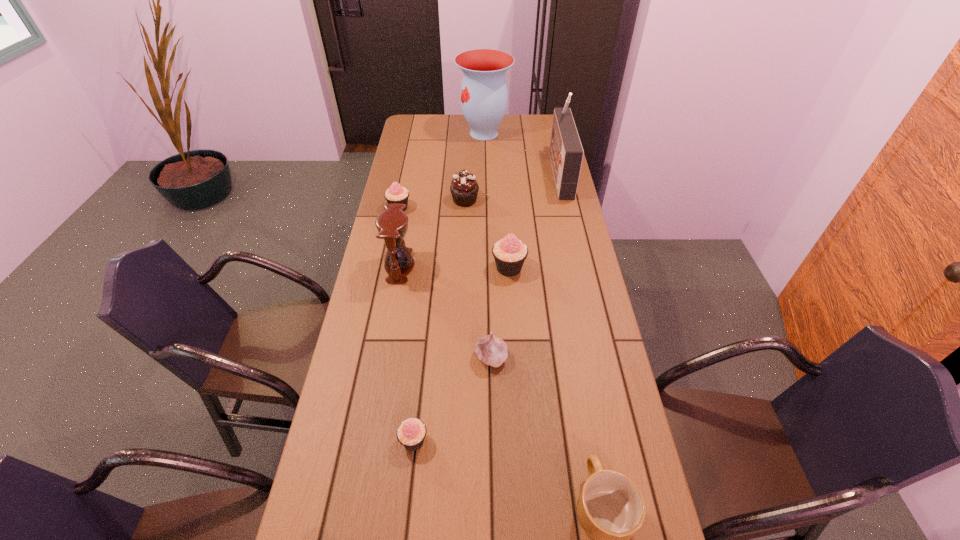
The width and height of the screenshot is (960, 540). In the image, there is a desktop. Identify the location of vacant space at the right edge. pyautogui.click(x=548, y=153).

You are a GUI agent. You are given a task and a screenshot of the screen. Output one action in this format:
    pyautogui.click(x=<x>, y=<y>)
    Task: Click on the vacant space at the far left corner of the desktop
    This screenshot has height=540, width=960.
    Given the screenshot: What is the action you would take?
    pyautogui.click(x=430, y=135)

Find the location of `blank space at the far right corner of the desktop`. blank space at the far right corner of the desktop is located at coordinates [x=529, y=120].

The image size is (960, 540). Find the location of `empty space between the white garlic and the third cupcake from left to right`. empty space between the white garlic and the third cupcake from left to right is located at coordinates click(478, 278).

You are a GUI agent. You are given a task and a screenshot of the screen. Output one action in this format:
    pyautogui.click(x=<x>, y=<y>)
    Task: Click on the vacant area that lies between the second cupcake from right to left and the shortest cupcake
    This screenshot has height=540, width=960.
    Given the screenshot: What is the action you would take?
    pyautogui.click(x=440, y=320)

At what (x,y) coordinates should I click in order to perform the action: click on unoccupied position between the hourglass and the rightmost cupcake. Please return your answer as a coordinate pair (x, y). Looking at the image, I should click on (454, 267).

The image size is (960, 540). I want to click on empty space between the farthest object and the brown hourglass, so click(x=442, y=200).

At what (x,y) coordinates should I click in order to perform the action: click on vacant space that is in between the hourglass and the tallest cupcake. Please return your answer as a coordinate pair (x, y). The height and width of the screenshot is (540, 960). Looking at the image, I should click on (454, 267).

I want to click on vacant region between the second pink cupcake from left to right and the rightmost pink cupcake, so click(462, 354).

This screenshot has height=540, width=960. I want to click on free spot between the hourglass and the garlic, so click(x=445, y=312).